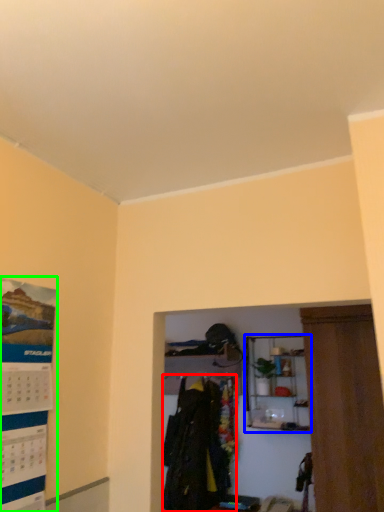
Question: Which object is positioned closest to clothing (highlighted by a red box)? Select from shelf (highlighted by a blue box) and poster page (highlighted by a green box).

Choices:
 (A) shelf
 (B) poster page

Answer: (A)